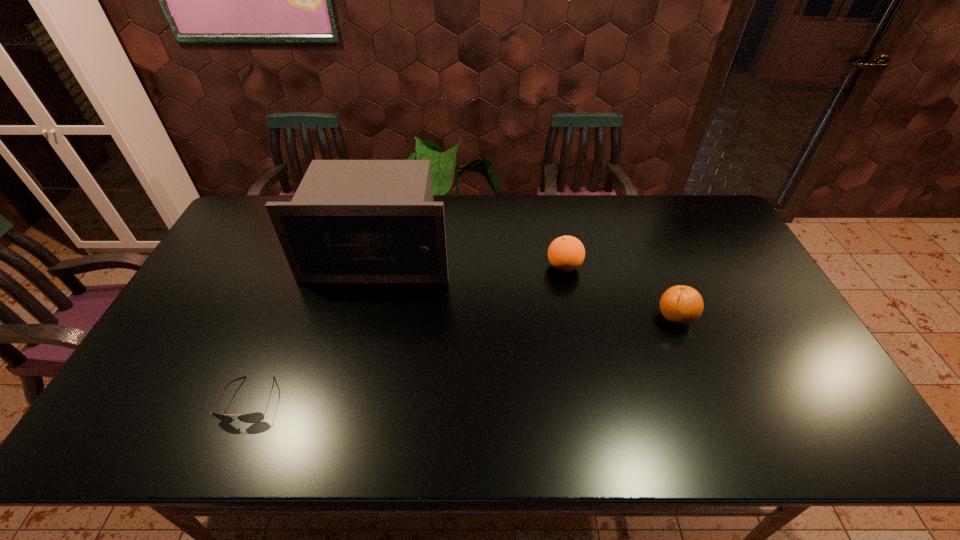
Locate an element on the screen. free region that satisfies the following two spatial constraints: 1. on the front-facing side of the right orange; 2. on the right side of the microwave oven is located at coordinates (364, 318).